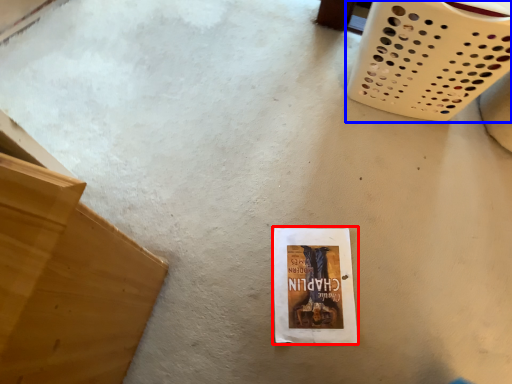
Question: Which object is further to the camera taking this photo, paperback book (highlighted by a red box) or basket (highlighted by a blue box)?

Choices:
 (A) paperback book
 (B) basket

Answer: (A)